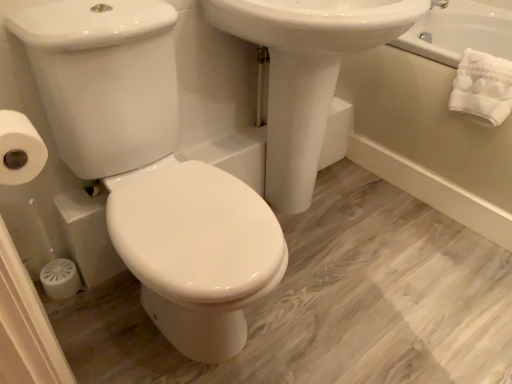
You are a GUI agent. You are given a task and a screenshot of the screen. Output one action in this format:
    pyautogui.click(x=<x>, y=<y>)
    Task: Click on the white glossy bathtub at upper right
    
    Given the screenshot: What is the action you would take?
    428,135

This screenshot has width=512, height=384. I want to click on white matte toilet paper at left, so click(19, 149).

Is white glossy porcelain at center oriented away from white matte toilet paper at left?

white glossy porcelain at center is not turned away from white matte toilet paper at left.

Where is `toilet paper that is on the left side of white glossy porcelain at center`? The width and height of the screenshot is (512, 384). toilet paper that is on the left side of white glossy porcelain at center is located at coordinates (19, 149).

Considering their positions, is white glossy porcelain at center located in front of or behind white matte toilet paper at left?

Visually, white glossy porcelain at center is located in front of white matte toilet paper at left.

From the image's perspective, between white matte toilet paper at left and white soft towel at upper right, which one is located above?

From the image's view, white soft towel at upper right is above.

Which is more to the left, white matte toilet paper at left or white soft towel at upper right?

white matte toilet paper at left is more to the left.

Is white matte toilet paper at left thinner than white soft towel at upper right?

Yes.

The image size is (512, 384). Identify the location of toilet paper located above the white soft towel at upper right (from a real-world perspective). click(x=19, y=149).

In the scene shown: Which object is closer to the camera taking this photo, white glossy sink at center or white matte toilet paper at left?

white matte toilet paper at left.

Choose the correct answer: Is white glossy sink at center inside white matte toilet paper at left or outside it?

white glossy sink at center is outside white matte toilet paper at left.

From the image's perspective, is white glossy sink at center positioned above or below white matte toilet paper at left?

From the image's perspective, white glossy sink at center appears above white matte toilet paper at left.

Are white glossy sink at center and white matte toilet paper at left located far from each other?

No, there isn't a large distance between white glossy sink at center and white matte toilet paper at left.

Is white glossy sink at center shorter than white soft towel at upper right?

In fact, white glossy sink at center may be taller than white soft towel at upper right.

From the image's perspective, is white glossy sink at center located above white soft towel at upper right?

No, from the image's perspective, white glossy sink at center is not above white soft towel at upper right.

Based on their sizes in the image, would you say white glossy sink at center is bigger or smaller than white soft towel at upper right?

white glossy sink at center is bigger than white soft towel at upper right.

Could you tell me if white glossy sink at center is facing white soft towel at upper right?

No, white glossy sink at center is not turned towards white soft towel at upper right.

In the scene shown: From the image's perspective, would you say white matte toilet paper at left is positioned over white glossy sink at center?

Actually, white matte toilet paper at left appears below white glossy sink at center in the image.

Can white glossy sink at center be found inside white matte toilet paper at left?

No, white glossy sink at center is not inside white matte toilet paper at left.

Based on the photo, in terms of size, does white matte toilet paper at left appear bigger or smaller than white glossy sink at center?

In the image, white matte toilet paper at left appears to be smaller than white glossy sink at center.

Would you say white matte toilet paper at left is to the left or to the right of white glossy sink at center in the picture?

In the image, white matte toilet paper at left appears on the left side of white glossy sink at center.

Considering the sizes of objects white glossy porcelain at center and white soft towel at upper right in the image provided, who is thinner, white glossy porcelain at center or white soft towel at upper right?

white soft towel at upper right is thinner.

Is white glossy porcelain at center oriented away from white soft towel at upper right?

No, white glossy porcelain at center is not facing the opposite direction of white soft towel at upper right.

Can you confirm if white glossy porcelain at center is taller than white soft towel at upper right?

Correct, white glossy porcelain at center is much taller as white soft towel at upper right.

Based on the photo, does white glossy porcelain at center lie behind white soft towel at upper right?

No, white glossy porcelain at center is in front of white soft towel at upper right.

Is white matte toilet paper at left outside of white glossy porcelain at center?

white matte toilet paper at left is positioned outside white glossy porcelain at center.

How different are the orientations of white matte toilet paper at left and white glossy porcelain at center in degrees?

They differ by 91.4 degrees in their facing directions.

Considering the relative sizes of white matte toilet paper at left and white glossy porcelain at center in the image provided, is white matte toilet paper at left wider than white glossy porcelain at center?

No.

Could you tell me if white matte toilet paper at left is turned towards white glossy porcelain at center?

Yes, white matte toilet paper at left is oriented towards white glossy porcelain at center.

Locate an element on the screen. toilet paper located above the white glossy porcelain at center (from the image's perspective) is located at coordinates (19, 149).

Find the location of a particular element. This screenshot has height=384, width=512. toilet paper that is on the left side of white soft towel at upper right is located at coordinates (19, 149).

Based on their spatial positions, is white glossy sink at center or white soft towel at upper right further from white glossy porcelain at center?

white soft towel at upper right.

Estimate the real-world distances between objects in this image. Which object is further from white glossy sink at center, white glossy bathtub at upper right or white matte toilet paper at left?

Based on the image, white matte toilet paper at left appears to be further to white glossy sink at center.

From the image, which object appears to be farther from white glossy sink at center, white glossy porcelain at center or white soft towel at upper right?

white soft towel at upper right lies further to white glossy sink at center than the other object.

From the image, which object appears to be nearer to white soft towel at upper right, white glossy porcelain at center or white glossy bathtub at upper right?

white glossy bathtub at upper right.

Based on their spatial positions, is white glossy bathtub at upper right or white soft towel at upper right closer to white glossy sink at center?

Among the two, white glossy bathtub at upper right is located nearer to white glossy sink at center.

Which object lies further to the anchor point white glossy bathtub at upper right, white glossy porcelain at center or white soft towel at upper right?

white glossy porcelain at center is further to white glossy bathtub at upper right.

Estimate the real-world distances between objects in this image. Which object is further from white glossy porcelain at center, white glossy bathtub at upper right or white matte toilet paper at left?

white glossy bathtub at upper right is positioned further to the anchor white glossy porcelain at center.

Based on their spatial positions, is white glossy porcelain at center or white matte toilet paper at left further from white glossy bathtub at upper right?

The object further to white glossy bathtub at upper right is white matte toilet paper at left.

At what (x,y) coordinates should I click in order to perform the action: click on sink between white matte toilet paper at left and white soft towel at upper right in the horizontal direction. Please return your answer as a coordinate pair (x, y). This screenshot has width=512, height=384. Looking at the image, I should click on (306, 72).

The height and width of the screenshot is (384, 512). Identify the location of sink between white matte toilet paper at left and white glossy bathtub at upper right. (306, 72).

At what (x,y) coordinates should I click in order to perform the action: click on porcelain between white matte toilet paper at left and white glossy bathtub at upper right. Please return your answer as a coordinate pair (x, y). This screenshot has height=384, width=512. Looking at the image, I should click on (152, 170).

Locate an element on the screen. The width and height of the screenshot is (512, 384). porcelain between white matte toilet paper at left and white soft towel at upper right is located at coordinates (152, 170).